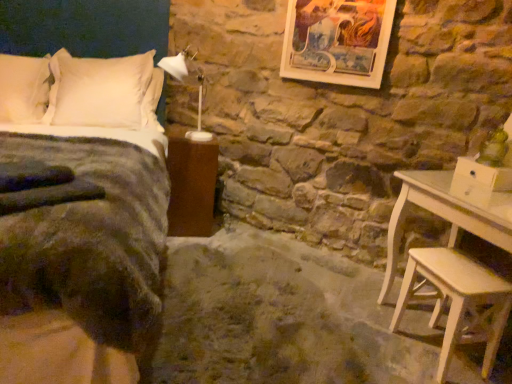
Question: Is white plastic lamp at upper center wider or thinner than velvet dark green bed at left?

Choices:
 (A) wide
 (B) thin

Answer: (B)

Question: Considering the relative positions of white plastic lamp at upper center and velvet dark green bed at left in the image provided, is white plastic lamp at upper center to the left or to the right of velvet dark green bed at left?

Choices:
 (A) left
 (B) right

Answer: (B)

Question: Which object is the closest to the white plastic lamp at upper center?

Choices:
 (A) velvet dark green bed at left
 (B) white soft pillow at upper left, the second pillow when ordered from right to left
 (C) white soft pillow at upper left, the 2th pillow viewed from the left
 (D) brown wood nightstand at lower left
 (E) light wood stool at lower right

Answer: (D)

Question: Which is farther from the white soft pillow at upper left, the 1th pillow from the left?

Choices:
 (A) white plastic lamp at upper center
 (B) white soft pillow at upper left, the 1th pillow when ordered from right to left
 (C) wooden framed artwork at upper center
 (D) velvet dark green bed at left
 (E) brown wood nightstand at lower left

Answer: (C)